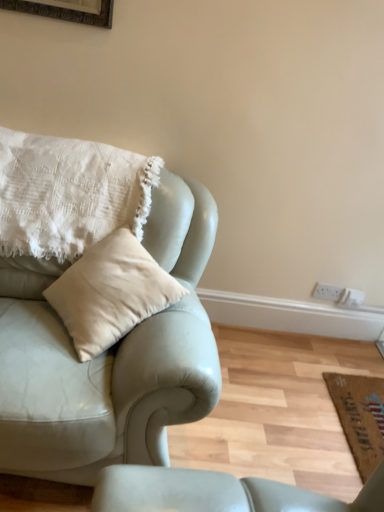
Locate an element on the screen. The image size is (384, 512). free space above brown woven mat at lower right (from a real-world perspective) is located at coordinates (368, 409).